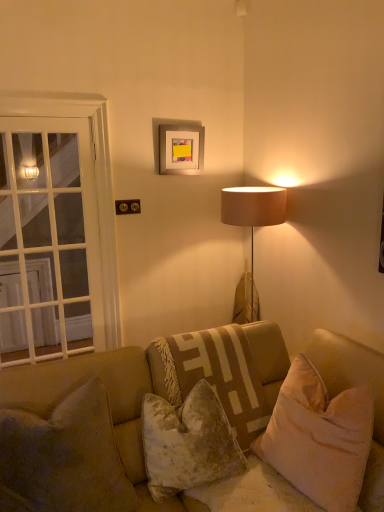
Question: Does white glass door at left have a smaller size compared to silver metallic picture frame at upper center?

Choices:
 (A) yes
 (B) no

Answer: (B)

Question: Is white glass door at left bigger than silver metallic picture frame at upper center?

Choices:
 (A) no
 (B) yes

Answer: (B)

Question: From a real-world perspective, is white glass door at left located beneath silver metallic picture frame at upper center?

Choices:
 (A) yes
 (B) no

Answer: (A)

Question: Is white glass door at left to the left of silver metallic picture frame at upper center from the viewer's perspective?

Choices:
 (A) yes
 (B) no

Answer: (A)

Question: From the image's perspective, is white glass door at left located beneath silver metallic picture frame at upper center?

Choices:
 (A) no
 (B) yes

Answer: (B)

Question: Can you confirm if white glass door at left is shorter than silver metallic picture frame at upper center?

Choices:
 (A) yes
 (B) no

Answer: (B)

Question: Is the surface of velvety beige pillow at lower left, which is the fourth pillow from right to left, in direct contact with velvet beige pillow at center, which appears as the 2th pillow when viewed from the left?

Choices:
 (A) no
 (B) yes

Answer: (A)

Question: Considering the relative sizes of velvety beige pillow at lower left, the 1th pillow viewed from the left, and velvet beige pillow at center, which appears as the 2th pillow when viewed from the left, in the image provided, is velvety beige pillow at lower left, the 1th pillow viewed from the left, wider than velvet beige pillow at center, which appears as the 2th pillow when viewed from the left,?

Choices:
 (A) yes
 (B) no

Answer: (A)

Question: Can you confirm if velvety beige pillow at lower left, the 1th pillow viewed from the left, is positioned to the left of velvet beige pillow at center, which is the third pillow in right-to-left order?

Choices:
 (A) yes
 (B) no

Answer: (A)

Question: Considering the relative sizes of velvety beige pillow at lower left, which is the fourth pillow from right to left, and velvet beige pillow at center, which appears as the 2th pillow when viewed from the left, in the image provided, is velvety beige pillow at lower left, which is the fourth pillow from right to left, taller than velvet beige pillow at center, which appears as the 2th pillow when viewed from the left,?

Choices:
 (A) no
 (B) yes

Answer: (B)

Question: Does velvety beige pillow at lower left, which is the fourth pillow from right to left, lie behind velvet beige pillow at center, which is the third pillow in right-to-left order?

Choices:
 (A) yes
 (B) no

Answer: (B)

Question: Is velvety beige pillow at lower left, the 1th pillow viewed from the left, at the right side of velvet beige pillow at center, which appears as the 2th pillow when viewed from the left?

Choices:
 (A) yes
 (B) no

Answer: (B)

Question: Can you confirm if velvet beige pillow at center, which is the third pillow in right-to-left order, is taller than velvet beige couch at center?

Choices:
 (A) no
 (B) yes

Answer: (A)